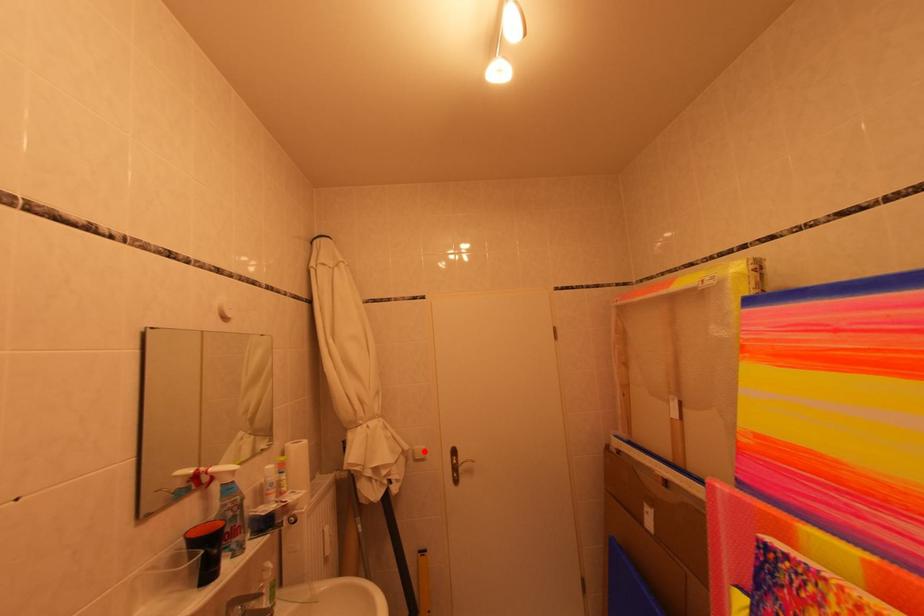
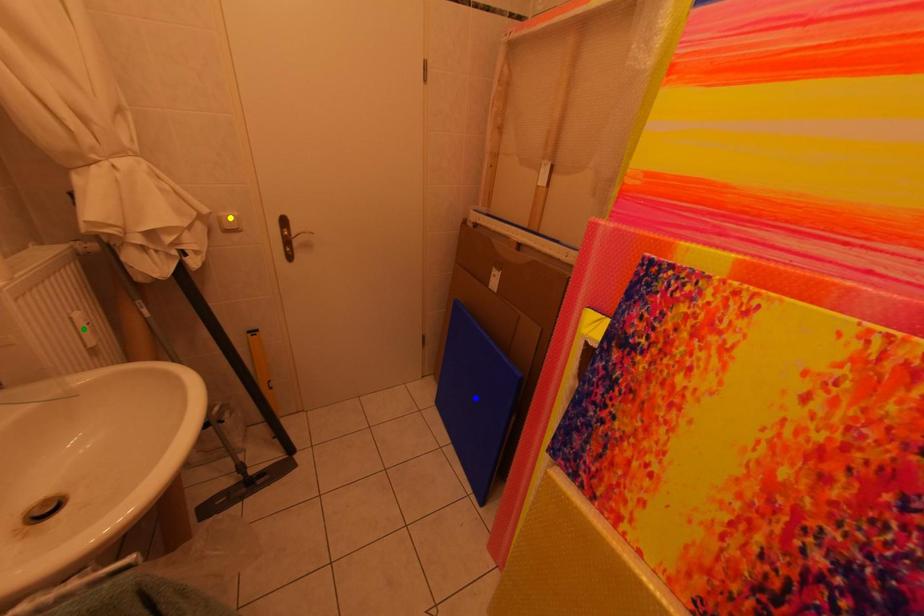
Question: I am providing you with two images of the same scene from different viewpoints. A red point is marked on the first image. You are given multiple points on the second image. Which spot in image 2 lines up with the point in image 1?

Choices:
 (A) green point
 (B) yellow point
 (C) blue point

Answer: (B)